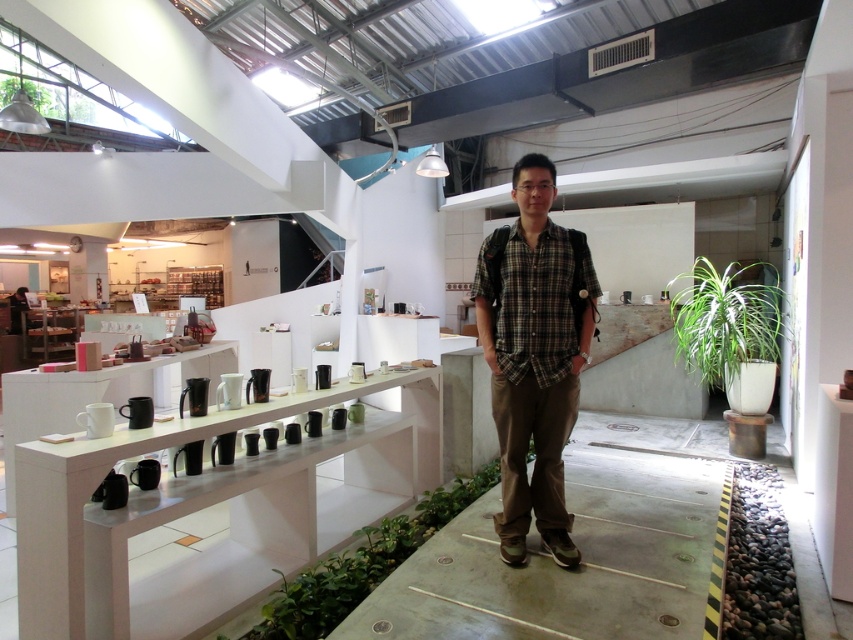
Question: Can you confirm if plaid cotton shirt at center is bigger than green leafy plant at right?

Choices:
 (A) yes
 (B) no

Answer: (B)

Question: Where is plaid cotton shirt at center located in relation to green leafy plant at right in the image?

Choices:
 (A) above
 (B) below

Answer: (B)

Question: Does plaid cotton shirt at center lie behind green leafy plant at right?

Choices:
 (A) yes
 (B) no

Answer: (B)

Question: Which point is farther from the camera taking this photo?

Choices:
 (A) (763, 285)
 (B) (555, 525)

Answer: (A)

Question: Which of the following is the closest to the observer?

Choices:
 (A) plaid cotton shirt at center
 (B) green leafy plant at right

Answer: (A)